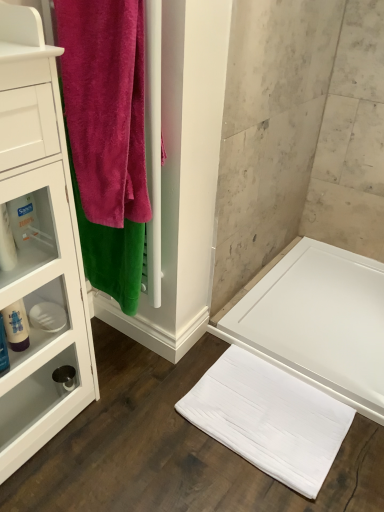
Identify the location of vacant area on top of white soft towel at lower center (from a real-world perspective). The width and height of the screenshot is (384, 512). (265, 409).